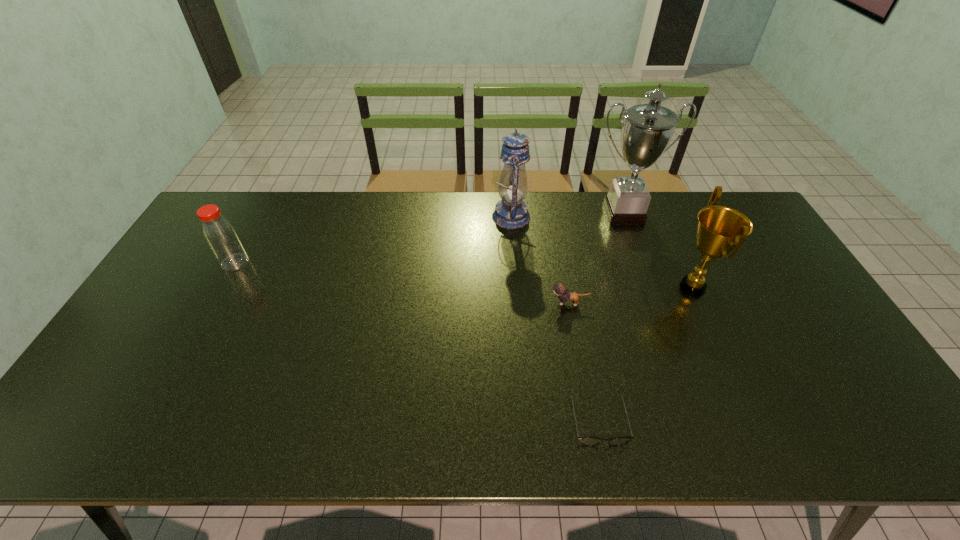
Locate an element on the screen. The image size is (960, 540). lantern positioned at the far edge is located at coordinates (511, 212).

In order to click on object situated at the near edge in this screenshot , I will do `click(588, 441)`.

Where is `object situated at the left edge`? object situated at the left edge is located at coordinates (219, 233).

Locate an element on the screen. vacant space at the far edge of the desktop is located at coordinates (376, 220).

What are the coordinates of `vacant area at the near edge of the desktop` in the screenshot? It's located at (797, 423).

Image resolution: width=960 pixels, height=540 pixels. In order to click on blank space at the left edge of the desktop in this screenshot , I will do `click(145, 336)`.

Where is `vacant area at the near left corner of the desktop`? vacant area at the near left corner of the desktop is located at coordinates (56, 436).

The image size is (960, 540). I want to click on free space at the far right corner of the desktop, so click(x=733, y=195).

Image resolution: width=960 pixels, height=540 pixels. I want to click on empty space between the tallest object and the leftmost object, so [429, 238].

At what (x,y) coordinates should I click in order to perform the action: click on vacant space in between the bottle and the nearest object. Please return your answer as a coordinate pair (x, y). The height and width of the screenshot is (540, 960). Looking at the image, I should click on (417, 341).